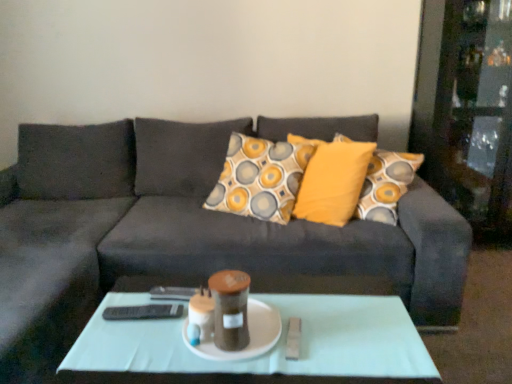
Identify the location of free spot in front of black plastic remote at center. (121, 353).